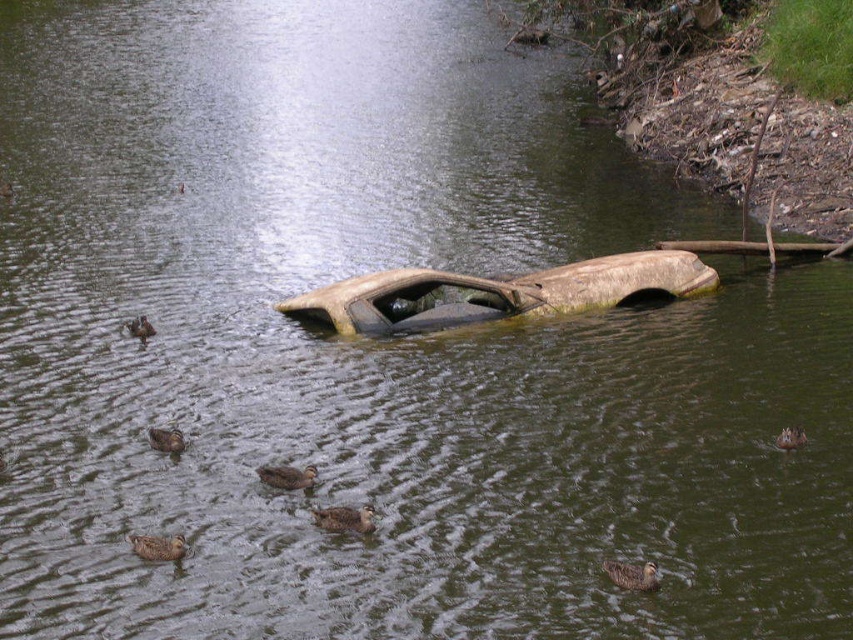
What do you see at coordinates (631, 573) in the screenshot?
I see `brown matte duck at lower center` at bounding box center [631, 573].

Is brown matte duck at lower center behind brown matte duck at lower left?

No, brown matte duck at lower center is closer to the viewer.

Find the location of `brown matte duck at lower center`. brown matte duck at lower center is located at coordinates (631, 573).

Can you confirm if brown matte duck at lower center is positioned above brown matte duck at upper left?

No, brown matte duck at lower center is not above brown matte duck at upper left.

Image resolution: width=853 pixels, height=640 pixels. I want to click on brown matte duck at lower center, so click(631, 573).

Describe the element at coordinates (631, 573) in the screenshot. Image resolution: width=853 pixels, height=640 pixels. I see `brown matte duck at lower center` at that location.

This screenshot has height=640, width=853. I want to click on brown matte duck at lower center, so [631, 573].

Is point (361, 532) positioned after point (142, 536)?

Yes, point (361, 532) is farther from viewer.

Who is taller, brown fuzzy duck at center or brown matte duck at lower left?

Standing taller between the two is brown fuzzy duck at center.

Does point (358, 532) come farther from viewer compared to point (170, 545)?

Yes, point (358, 532) is behind point (170, 545).

The width and height of the screenshot is (853, 640). In order to click on brown fuzzy duck at center in this screenshot , I will do `click(344, 518)`.